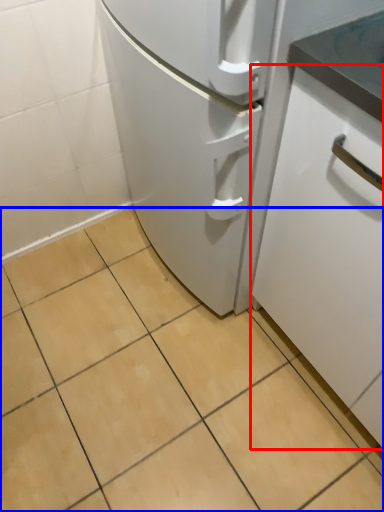
Question: Which object is further to the camera taking this photo, cabinetry (highlighted by a red box) or ceramic tile (highlighted by a blue box)?

Choices:
 (A) cabinetry
 (B) ceramic tile

Answer: (B)